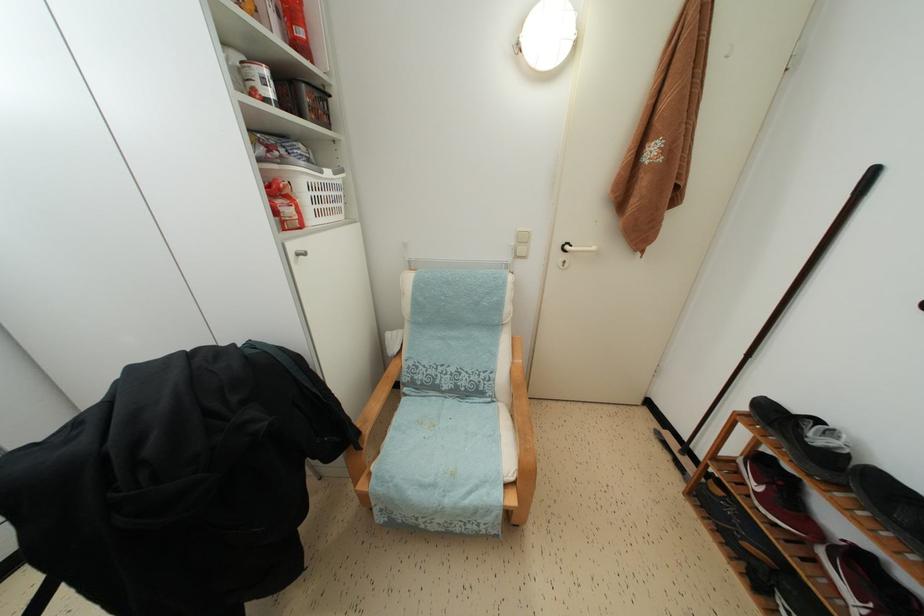
This screenshot has height=616, width=924. What do you see at coordinates (576, 248) in the screenshot?
I see `the white door handle` at bounding box center [576, 248].